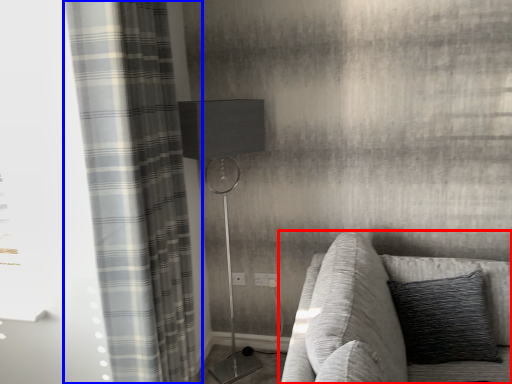
Question: Which object is closer to the camera taking this photo, studio couch (highlighted by a red box) or curtain (highlighted by a blue box)?

Choices:
 (A) studio couch
 (B) curtain

Answer: (A)